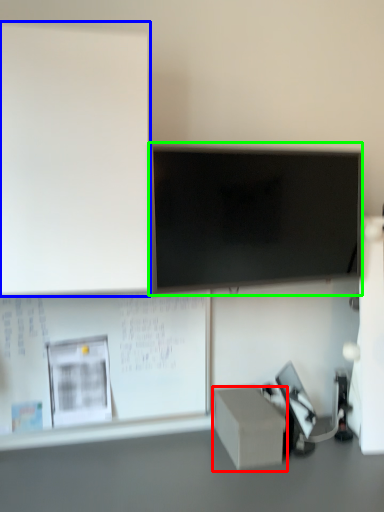
Question: Which object is positioned closest to box (highlighted by a red box)? Select from bulletin board (highlighted by a blue box) and television (highlighted by a green box).

Choices:
 (A) bulletin board
 (B) television

Answer: (B)